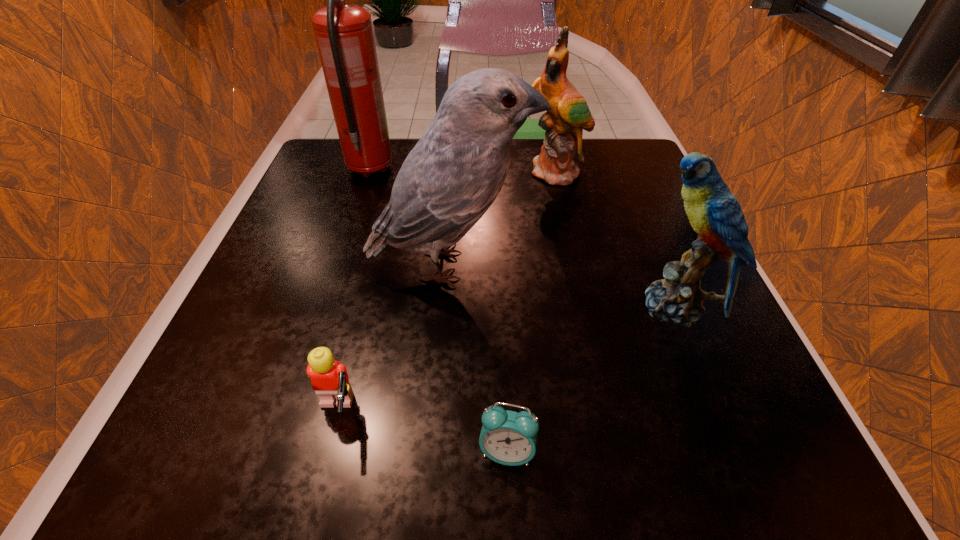
You are a GUI agent. You are given a task and a screenshot of the screen. Output one action in this format:
    pyautogui.click(x=<x>, y=<y>)
    Task: Click on the free spot that satisfies the following two spatial constraints: 1. on the front-facing side of the fifth object from left to right; 2. on the front-facing side of the leftmost parrot
    Image resolution: width=960 pixels, height=540 pixels.
    Given the screenshot: What is the action you would take?
    pyautogui.click(x=578, y=266)